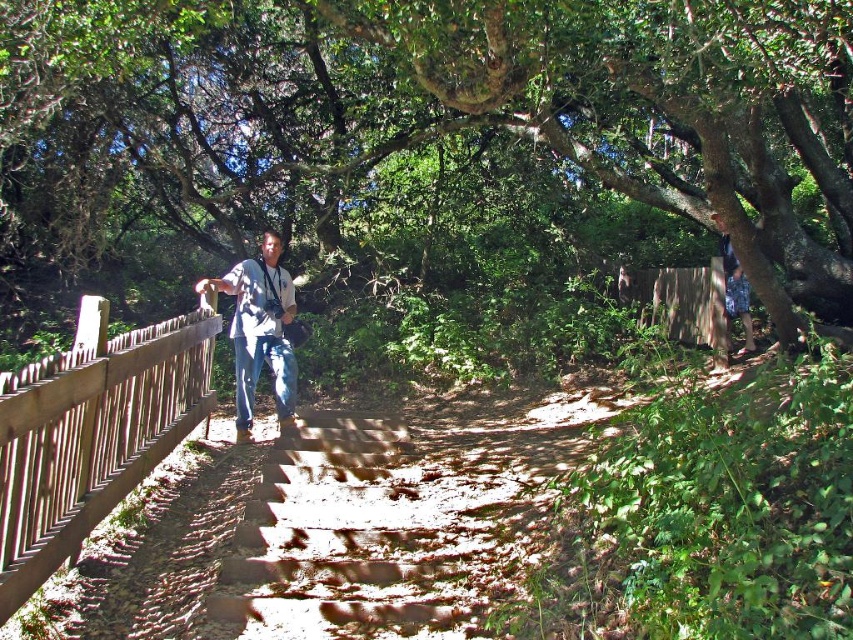
Question: Is green leafy tree at upper center smaller than matte gray shirt at center?

Choices:
 (A) yes
 (B) no

Answer: (B)

Question: Can you confirm if matte gray shirt at center is positioned above blue jeans at center?

Choices:
 (A) no
 (B) yes

Answer: (B)

Question: Which is nearer to the matte gray shirt at center?

Choices:
 (A) blue jeans at center
 (B) green leafy tree at upper center
 (C) brown wooden fence at left

Answer: (A)

Question: Which point appears closest to the camera in this image?

Choices:
 (A) (36, 424)
 (B) (392, 211)

Answer: (A)

Question: Which point is farther to the camera?

Choices:
 (A) blue jeans at center
 (B) brown wooden fence at left
 (C) matte gray shirt at center

Answer: (A)

Question: Does green leafy tree at upper center have a lesser width compared to blue jeans at center?

Choices:
 (A) no
 (B) yes

Answer: (A)